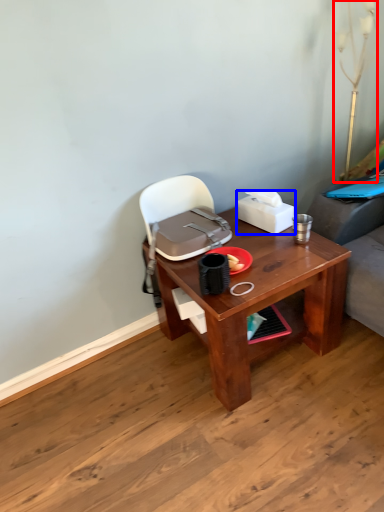
Question: Which point is further to the camera, table lamp (highlighted by a red box) or box (highlighted by a blue box)?

Choices:
 (A) table lamp
 (B) box

Answer: (B)